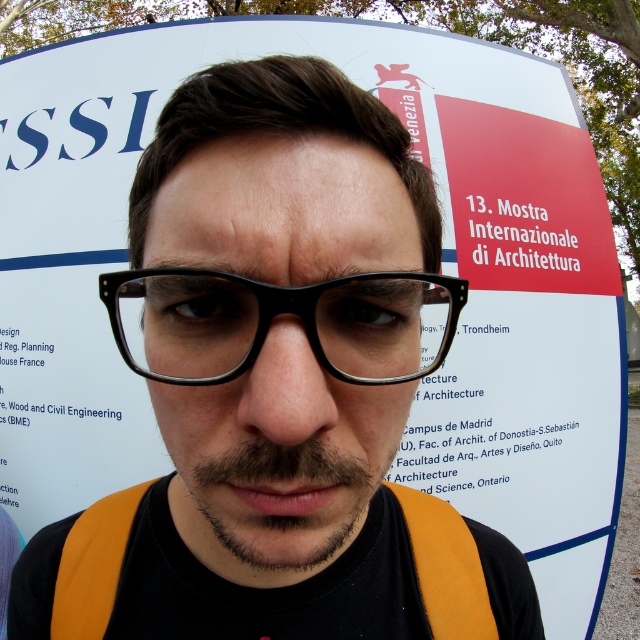
Question: Which object is closer to the camera taking this photo?

Choices:
 (A) dark brown stubble at center
 (B) black plastic glasses at center

Answer: (A)

Question: Where is black plastic glasses at center located in relation to dark brown stubble at center in the image?

Choices:
 (A) right
 (B) left

Answer: (A)

Question: Which of the following is the farthest from the observer?

Choices:
 (A) (138, 323)
 (B) (288, 524)

Answer: (A)

Question: Is black plastic glasses at center positioned in front of dark brown stubble at center?

Choices:
 (A) no
 (B) yes

Answer: (A)

Question: Among these points, which one is farthest from the camera?

Choices:
 (A) (307, 323)
 (B) (243, 525)

Answer: (B)

Question: Is black plastic glasses at center positioned before dark brown stubble at center?

Choices:
 (A) no
 (B) yes

Answer: (A)